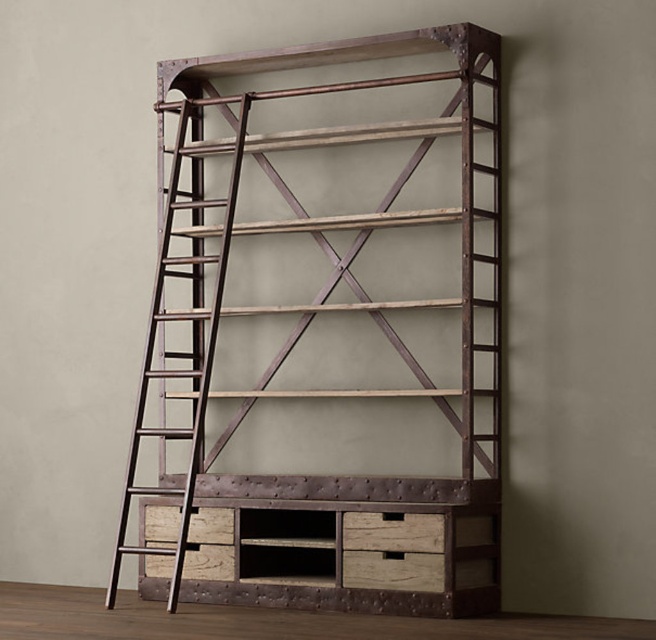
Question: Among these points, which one is farthest from the camera?

Choices:
 (A) (417, 604)
 (B) (407, 372)
 (C) (239, 154)

Answer: (B)

Question: Is rustic wood bookshelf at center below rustic wood crate at center?

Choices:
 (A) no
 (B) yes

Answer: (A)

Question: Which object appears farthest from the camera in this image?

Choices:
 (A) rustic wood bookshelf at center
 (B) rustic wood crate at center
 (C) rustic wood ladder at left

Answer: (C)

Question: From the image, what is the correct spatial relationship of rustic wood crate at center in relation to rustic wood ladder at left?

Choices:
 (A) right
 (B) left

Answer: (A)

Question: Is the position of rustic wood bookshelf at center less distant than that of rustic wood crate at center?

Choices:
 (A) no
 (B) yes

Answer: (A)

Question: Which object appears farthest from the camera in this image?

Choices:
 (A) rustic wood bookshelf at center
 (B) rustic wood ladder at left

Answer: (B)